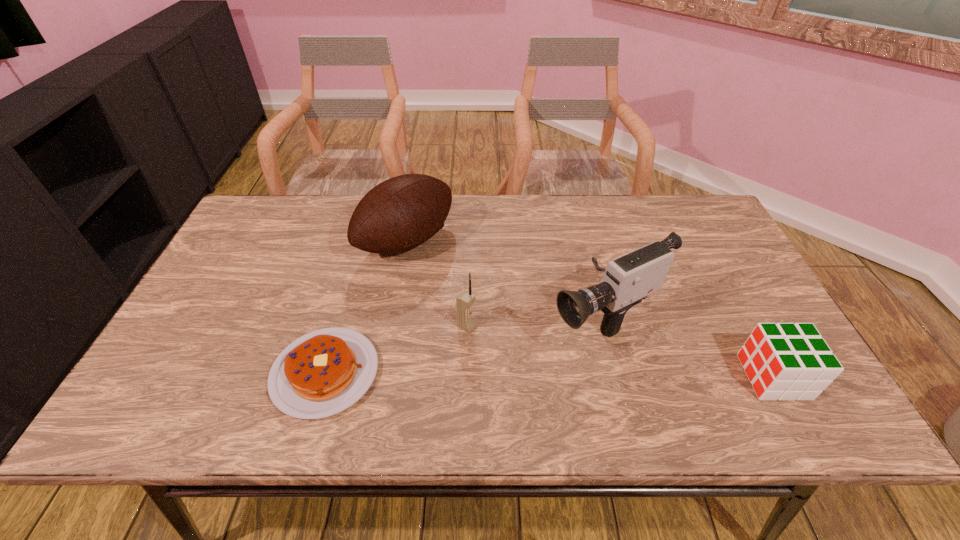
Identify the location of blank region between the camcorder and the cube. (687, 347).

I want to click on free space between the football and the third object from right to left, so click(437, 284).

Identify the location of vacant area between the fourth object from left to right and the football. (504, 279).

What are the coordinates of `blank region between the third shortest object and the rightmost object` in the screenshot? It's located at (620, 352).

I want to click on free space between the shortest object and the third tallest object, so click(396, 349).

This screenshot has width=960, height=540. In order to click on blank region between the shortest object and the fourth object from left to right in this screenshot , I will do `click(464, 345)`.

The height and width of the screenshot is (540, 960). What are the coordinates of `free space between the cellular telephone and the shortest object` in the screenshot? It's located at [x=396, y=349].

Find the location of `empty location between the cellular telephone and the second object from right to left`. empty location between the cellular telephone and the second object from right to left is located at coordinates (534, 321).

Locate an element on the screen. The height and width of the screenshot is (540, 960). free space between the rightmost object and the camcorder is located at coordinates (687, 347).

The width and height of the screenshot is (960, 540). In order to click on free space between the camcorder and the football in this screenshot , I will do `click(504, 279)`.